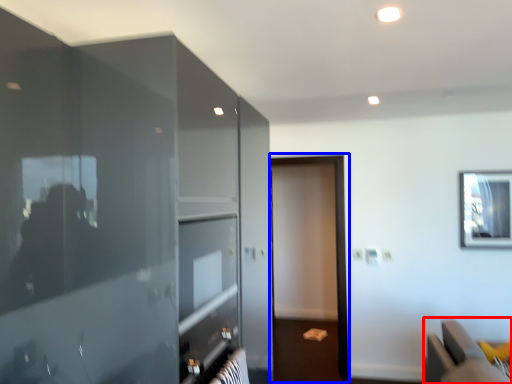
Question: Which object appears farthest to the camera in this image, furniture (highlighted by a red box) or screen door (highlighted by a blue box)?

Choices:
 (A) furniture
 (B) screen door

Answer: (B)